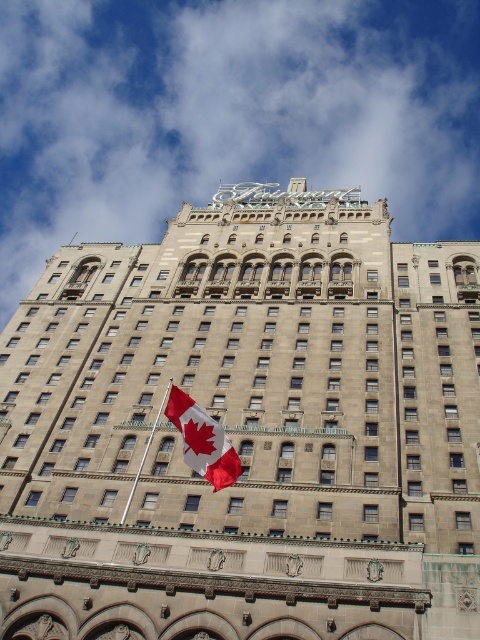
Can you confirm if stone textured building at center is thinner than metallic flag pole at center?

Incorrect, stone textured building at center's width is not less than metallic flag pole at center's.

Describe the element at coordinates (245, 429) in the screenshot. I see `stone textured building at center` at that location.

The width and height of the screenshot is (480, 640). Find the location of `stone textured building at center`. stone textured building at center is located at coordinates (245, 429).

How distant is red and white fabric flag at center from metallic flag pole at center?

red and white fabric flag at center is 31.03 feet away from metallic flag pole at center.

Is red and white fabric flag at center below metallic flag pole at center?

No.

Is point (196, 458) positioned before point (139, 468)?

Yes, it is in front of point (139, 468).

Where is `red and white fabric flag at center`? Image resolution: width=480 pixels, height=640 pixels. red and white fabric flag at center is located at coordinates (203, 440).

Is stone textured building at center bigger than red and white fabric flag at center?

Yes.

Can you confirm if stone textured building at center is smaller than red and white fabric flag at center?

Actually, stone textured building at center might be larger than red and white fabric flag at center.

Who is more forward, (130,246) or (238,474)?

Point (238,474) is in front.

Identify the location of stone textured building at center. (245, 429).